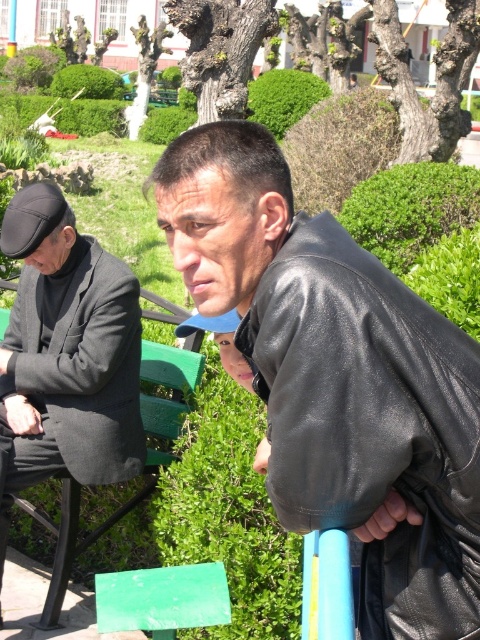
Does point (47, 330) come behind point (456, 196)?

No, (47, 330) is closer to viewer.

Is point (111, 388) farther from viewer compared to point (423, 208)?

No, it is in front of (423, 208).

At what (x,y) coordinates should I click in order to perform the action: click on dark gray woolen jacket at left. Please return your answer as a coordinate pair (x, y). The height and width of the screenshot is (640, 480). Looking at the image, I should click on (66, 355).

Looking at this image, which is more to the right, dark gray woolen jacket at left or green leafy hedge at upper center?

Positioned to the right is green leafy hedge at upper center.

Find the location of `dark gray woolen jacket at left`. dark gray woolen jacket at left is located at coordinates (66, 355).

Can you confirm if black leather jacket at upper right is wider than dark gray woolen jacket at left?

No, black leather jacket at upper right is not wider than dark gray woolen jacket at left.

Describe the element at coordinates (371, 426) in the screenshot. I see `black leather jacket at upper right` at that location.

Measure the distance between point [418,340] and camera.

They are 1.81 meters apart.

Where is `black leather jacket at upper right`? black leather jacket at upper right is located at coordinates (371, 426).